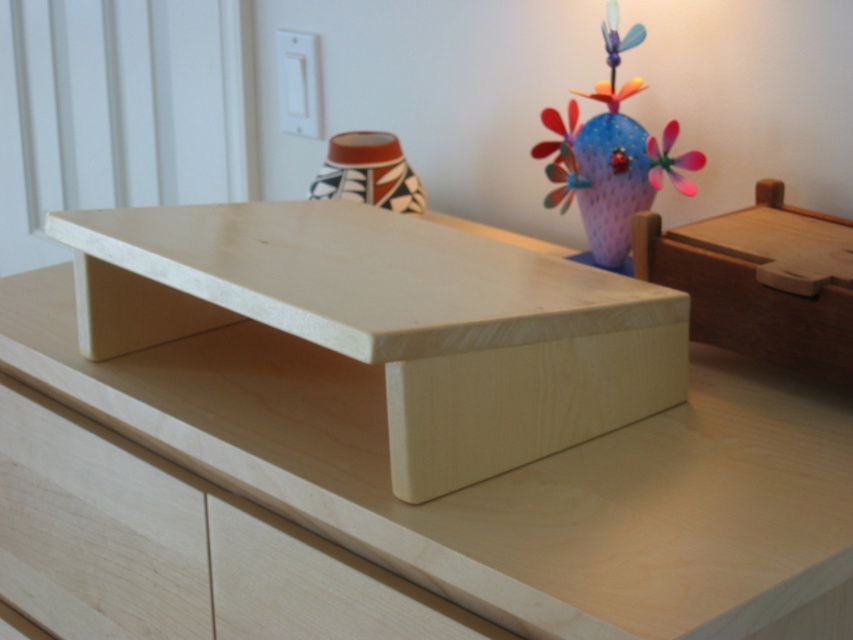
Question: Is matte purple vase at upper right positioned at the back of matte plastic flower at upper right?

Choices:
 (A) yes
 (B) no

Answer: (B)

Question: Is natural wood table at center bigger than pink plastic flower at upper right?

Choices:
 (A) no
 (B) yes

Answer: (B)

Question: Does matte geometric vase at center come behind matte plastic flower at upper right?

Choices:
 (A) no
 (B) yes

Answer: (B)

Question: Which point is farther from the camera taking this photo?

Choices:
 (A) (666, 170)
 (B) (554, 150)

Answer: (B)

Question: Which object is closer to the camera taking this photo?

Choices:
 (A) natural wood table at center
 (B) natural wood drawer at lower left
 (C) pink plastic flower at upper right

Answer: (A)

Question: Considering the real-world distances, which object is farthest from the wooden puzzle box at right?

Choices:
 (A) pink plastic flower at upper right
 (B) matte plastic flower at upper right
 (C) natural wood drawer at center
 (D) matte purple vase at upper right

Answer: (C)